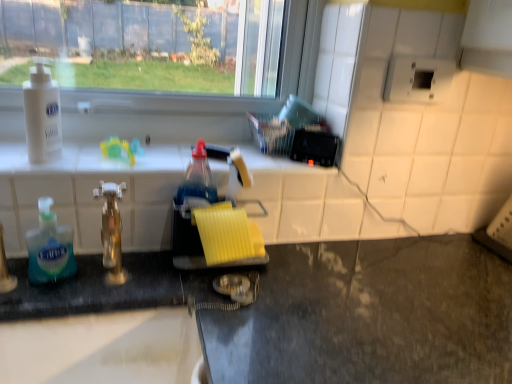
I want to click on unoccupied region to the right of yellow sponge at center, so click(x=307, y=273).